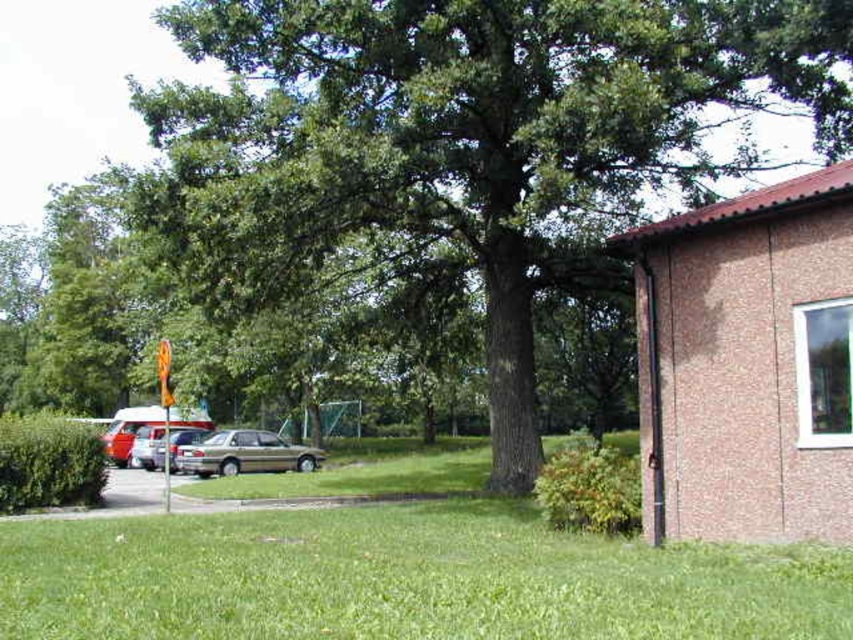
Between green grass at center and silver metallic car at center-left, which one has more height?

With more height is green grass at center.

Describe the element at coordinates (403, 579) in the screenshot. I see `green grass at center` at that location.

The image size is (853, 640). Identify the location of green grass at center. (403, 579).

Is metallic gold sedan at center above silver metallic car at center-left?

Actually, metallic gold sedan at center is below silver metallic car at center-left.

Locate an element on the screen. This screenshot has width=853, height=640. metallic gold sedan at center is located at coordinates (244, 452).

Does green leafy tree at center have a greater width compared to silver metallic car at center-left?

Yes.

Which is above, green leafy tree at center or silver metallic car at center-left?

green leafy tree at center is above.

Measure the distance between point (527, 342) and camera.

The distance of point (527, 342) from camera is 15.99 meters.

At what (x,y) coordinates should I click in order to perform the action: click on green leafy tree at center. Please return your answer as a coordinate pair (x, y). The height and width of the screenshot is (640, 853). Looking at the image, I should click on (466, 141).